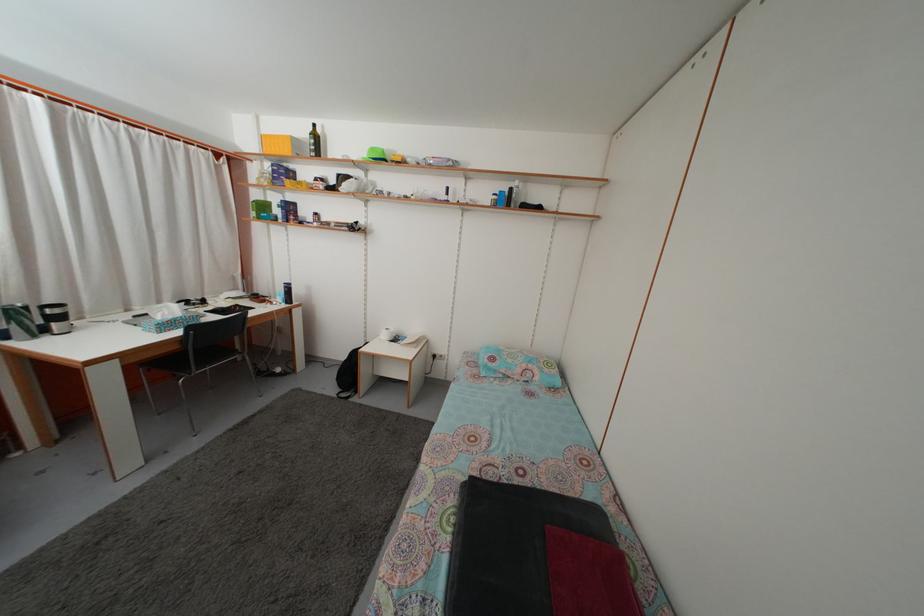
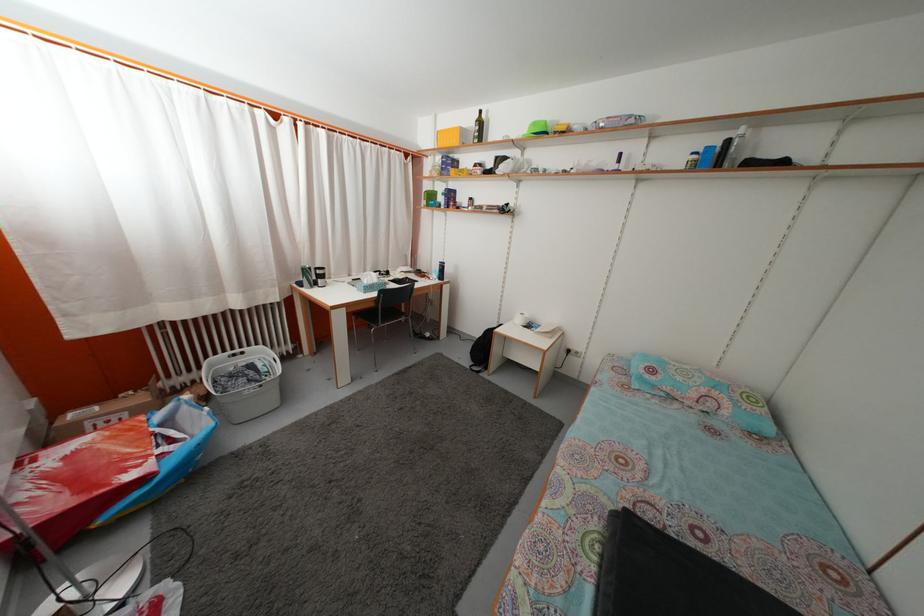
Where in the second image is the point corresponding to (31,315) from the first image?

(315, 276)